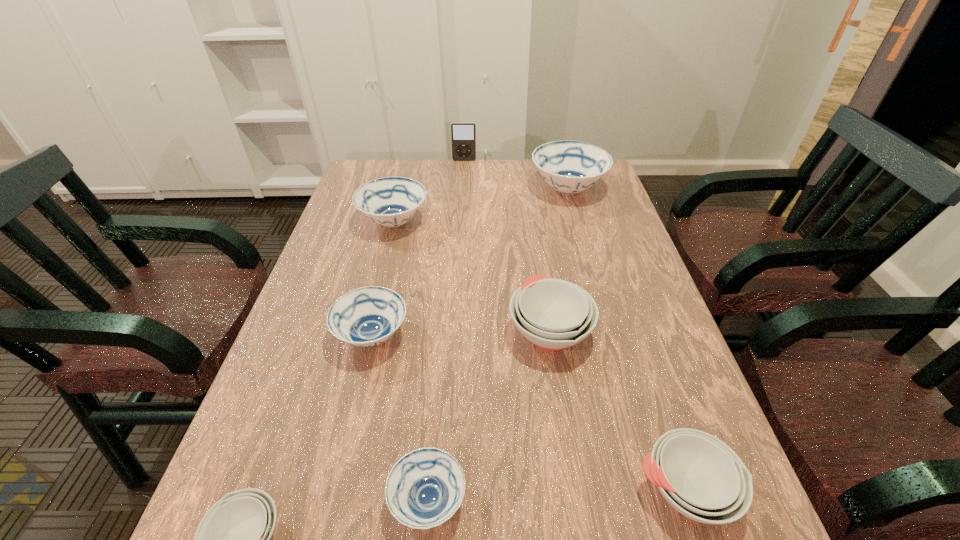
I want to click on free space located 0.330m on the left of the tallest soup bowl, so click(x=429, y=190).

Find the location of `vacant space located 0.300m on the front of the second biggest blue soup bowl`. vacant space located 0.300m on the front of the second biggest blue soup bowl is located at coordinates click(x=369, y=323).

At what (x,y) coordinates should I click in order to perform the action: click on vacant space located 0.210m on the back of the biggest white soup bowl. Please return your answer as a coordinate pair (x, y). The width and height of the screenshot is (960, 540). Looking at the image, I should click on (537, 246).

What are the coordinates of `vacant space situated 0.380m on the back of the third biggest blue soup bowl` in the screenshot? It's located at (400, 218).

Find the location of a particular element. free spot located on the left of the second biggest white soup bowl is located at coordinates [x=450, y=490].

Find the location of a particular element. Image resolution: width=960 pixels, height=540 pixels. iPod situated at the far edge is located at coordinates (463, 134).

You are a GUI agent. You are given a task and a screenshot of the screen. Output one action in this format:
    pyautogui.click(x=<x>, y=<y>)
    Task: Click on the soup bowl located at the far edge
    
    Given the screenshot: What is the action you would take?
    pyautogui.click(x=570, y=167)

Locate an element on the screen. object located at the near edge is located at coordinates (700, 476).

You are a GUI agent. You are given a task and a screenshot of the screen. Output one action in this format:
    pyautogui.click(x=<x>, y=<y>)
    Task: Click on the object that is at the far right corner
    
    Given the screenshot: What is the action you would take?
    pyautogui.click(x=570, y=167)

You are a GUI agent. You are given a task and a screenshot of the screen. Output one action in this format:
    pyautogui.click(x=<x>, y=<y>)
    Task: Click on the object present at the near right corner
    Image resolution: width=960 pixels, height=540 pixels.
    Given the screenshot: What is the action you would take?
    pyautogui.click(x=700, y=476)